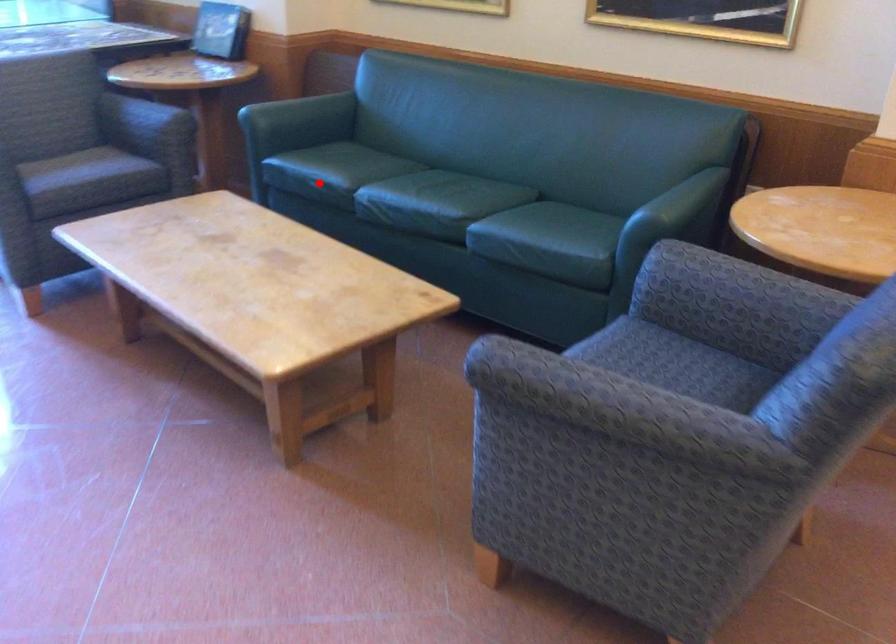
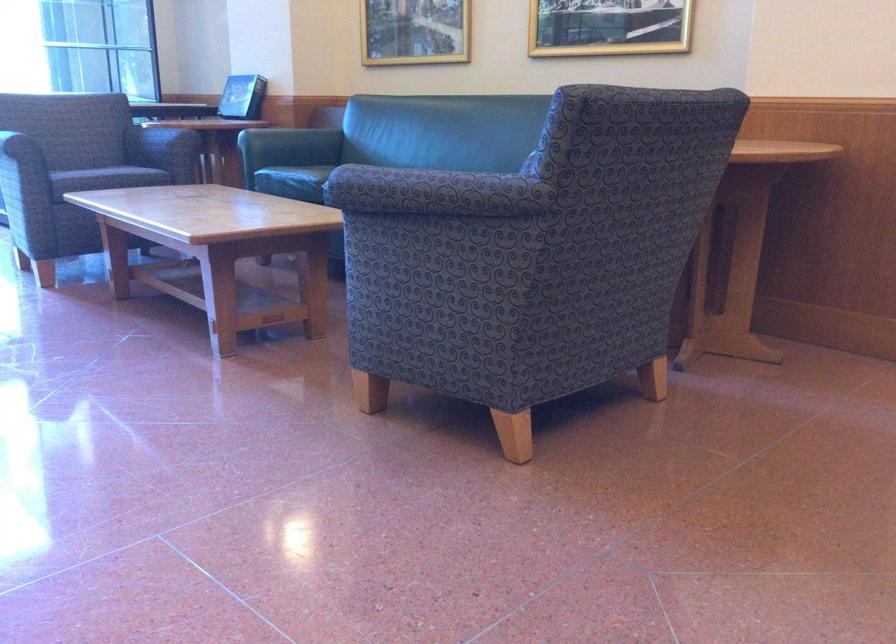
Question: I am providing you with two images of the same scene from different viewpoints. Image1 has a red point marked. In image2, the corresponding 3D location appears at what relative position? Reply with the corresponding letter.

Choices:
 (A) Closer
 (B) Farther

Answer: (B)